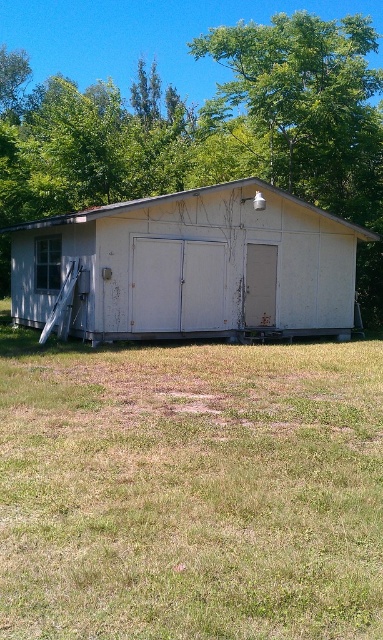
Question: Can you confirm if green leafy tree at upper center is bigger than white matte shed at center?

Choices:
 (A) yes
 (B) no

Answer: (A)

Question: Can you confirm if green leafy tree at upper center is thinner than white matte shed at center?

Choices:
 (A) no
 (B) yes

Answer: (A)

Question: Which point is closer to the camera?

Choices:
 (A) white matte shed at center
 (B) brown dry grass at center
 (C) green leafy tree at upper center

Answer: (B)

Question: Which of the following is the closest to the observer?

Choices:
 (A) (322, 508)
 (B) (9, 173)
 (C) (263, 205)

Answer: (A)

Question: Which object is positioned farthest from the white matte shed at center?

Choices:
 (A) green leafy tree at upper center
 (B) brown dry grass at center

Answer: (A)

Question: Is green leafy tree at upper center to the left of white matte shed at center from the viewer's perspective?

Choices:
 (A) yes
 (B) no

Answer: (A)